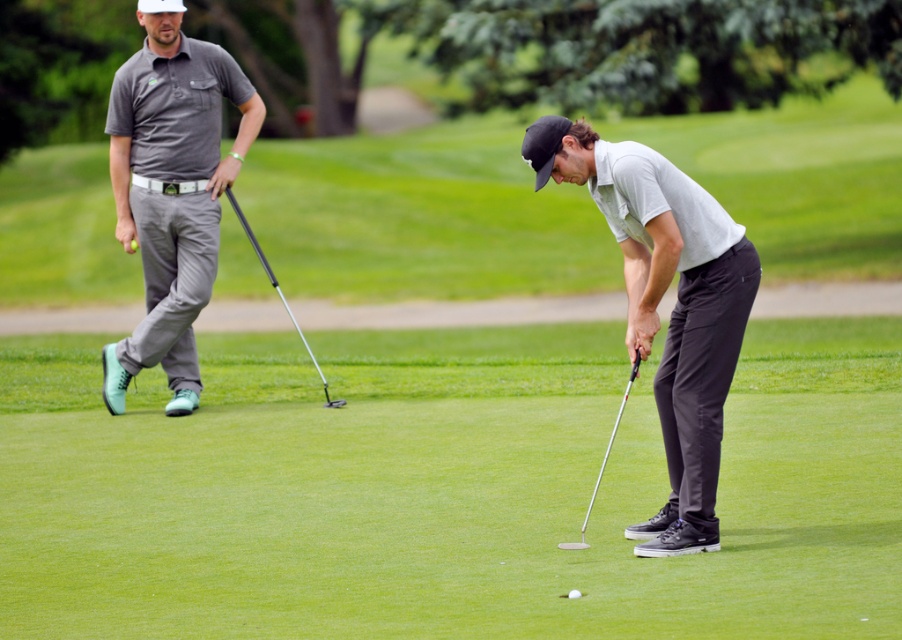
You are a golfer trying to place a green matte golf ball at center into the hole. The metallic silver putter at center is in your way. Can you move the ball without touching the putter?

Result: The metallic silver putter at center is wider than the green matte golf ball at center. Since the putter is wider, there might not be enough space to move the ball without touching it. You should check the clearance between them.

You are a golfer trying to line up your putt. You notice the metallic silver putter at center and the green matte golf ball at center. Which object is positioned lower in the image?

The metallic silver putter at center is located below the green matte golf ball at center, so it is positioned lower in the image.